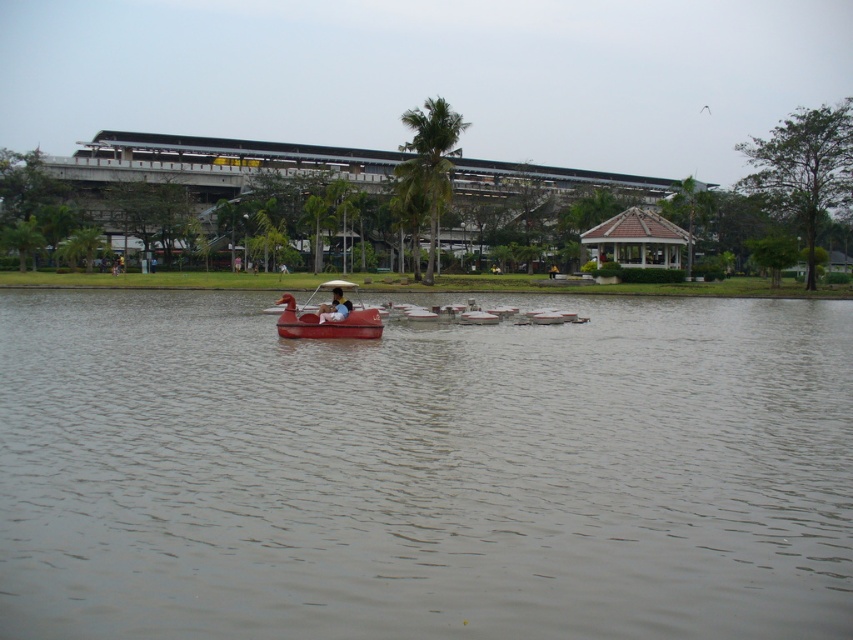
You are standing on the dock and see both the rubber duck boat at center and the white plastic boat at center. Which boat appears nearer to you?

The rubber duck boat at center appears nearer because it is closer to the viewer compared to the white plastic boat at center.

You are planning to take a ride on the water in the serene outdoor scene. You see the matte plastic duck boat at center and the white plastic boat at center. Which boat is narrower?

The matte plastic duck boat at center is narrower than the white plastic boat at center according to the description.

You are standing on the dock and see two boats in the water. The first is a matte plastic duck boat at center and the second is a white plastic boat at center. You want to row to the nearest one. Which boat should you choose?

Both the matte plastic duck boat at center and the white plastic boat at center are located at the same central position in the water, so they are equally distant from you. However, according to the description, they are 8.54 meters apart from each other. Therefore, you can choose either one as they are both equidistant from your current position on the dock.